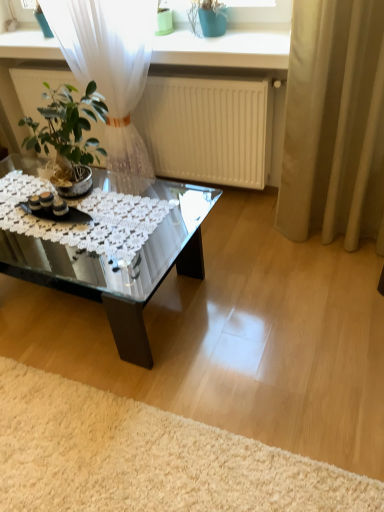
Find the location of a particular element. Image resolution: width=384 pixels, height=512 pixels. free space that is in between transparent glass coffee table at center and white shaggy rug at lower left is located at coordinates (256, 369).